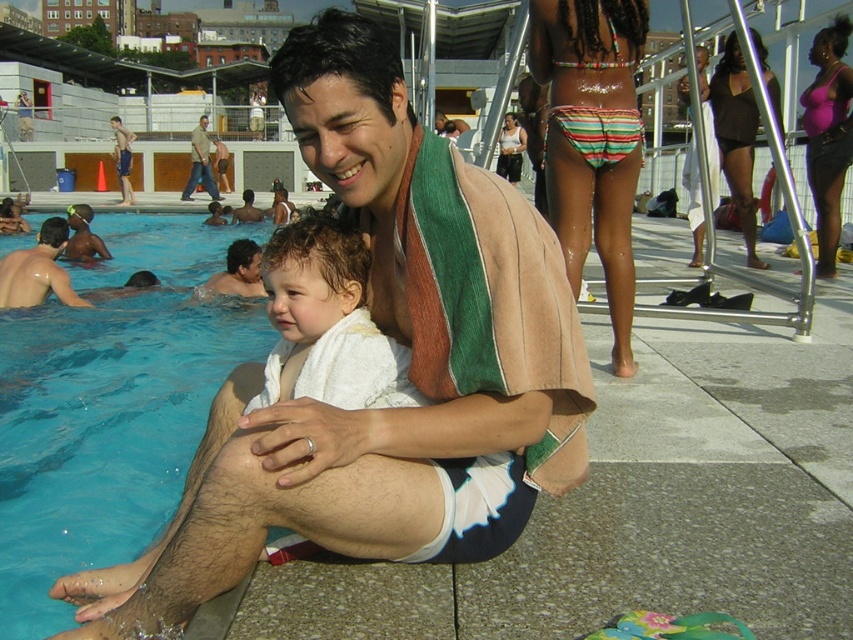
You are a photographer trying to capture a candid shot of the man and child. You notice the white towel at center and the khaki cotton pants at center in your frame. Which item should you adjust your focus to ensure the smaller object is in sharp focus?

The white towel at center is smaller than the khaki cotton pants at center, so you should adjust your focus to the white towel at center to ensure the smaller object is in sharp focus.

You are a photographer standing at the edge of the pool. You want to take a photo of the khaki cotton pants at center without the blue smooth water at lower left appearing in the foreground. Is this possible?

The blue smooth water at lower left is in front of the khaki cotton pants at center, so it will block the view. To avoid the water in the foreground, you need to move to a position where the khaki cotton pants at center is between you and the blue smooth water at lower left.

You are standing at the point labeled as point (270, 296) in the image. The pool deck is behind you. If you turn around, will you face the pool or the pool deck?

The pool deck is behind the point labeled as point (270, 296). When you turn around, you will face the pool deck.